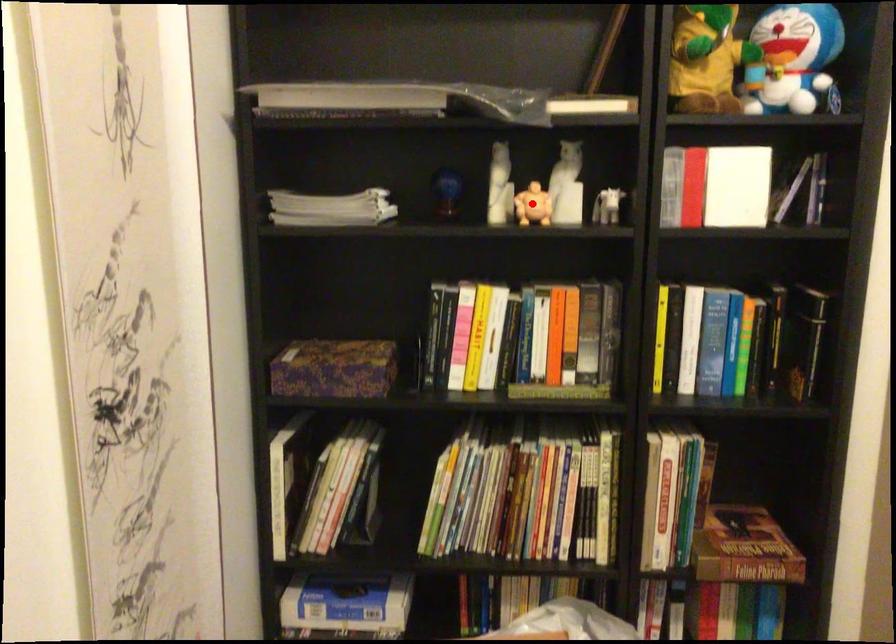
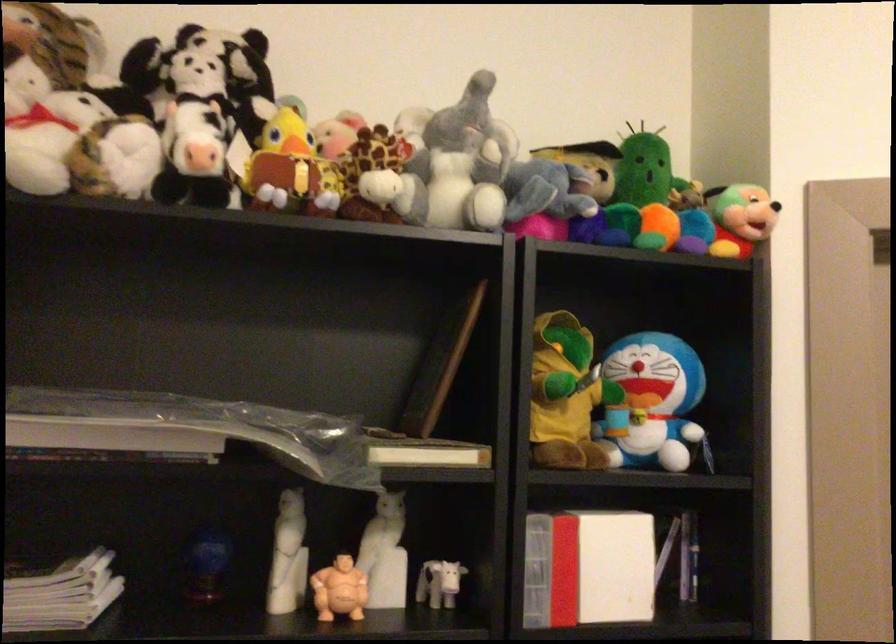
Question: I am providing you with two images of the same scene from different viewpoints. A red point is shown in image1. For the corresponding object point in image2, is it positioned nearer or farther from the camera?

Choices:
 (A) Nearer
 (B) Farther

Answer: (A)